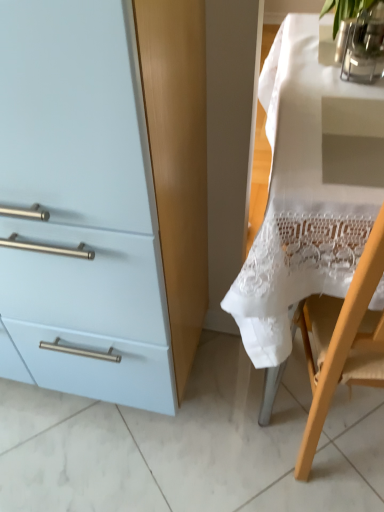
Question: From a real-world perspective, is white lace tablecloth at right physically above clear glass vase at upper right, the second glass vase positioned from the back?

Choices:
 (A) no
 (B) yes

Answer: (A)

Question: From the image's perspective, is white lace tablecloth at right beneath clear glass vase at upper right, which is counted as the 1th glass vase, starting from the front?

Choices:
 (A) no
 (B) yes

Answer: (B)

Question: From a real-world perspective, is white lace tablecloth at right below clear glass vase at upper right, which is counted as the 1th glass vase, starting from the front?

Choices:
 (A) no
 (B) yes

Answer: (B)

Question: Considering the relative sizes of white lace tablecloth at right and clear glass vase at upper right, the second glass vase positioned from the back, in the image provided, is white lace tablecloth at right shorter than clear glass vase at upper right, the second glass vase positioned from the back,?

Choices:
 (A) no
 (B) yes

Answer: (A)

Question: Does white lace tablecloth at right lie behind clear glass vase at upper right, which is counted as the 1th glass vase, starting from the front?

Choices:
 (A) yes
 (B) no

Answer: (B)

Question: Considering the positions of point (372, 79) and point (336, 47), is point (372, 79) closer or farther from the camera than point (336, 47)?

Choices:
 (A) farther
 (B) closer

Answer: (B)

Question: Considering the positions of clear glass vase at upper right, the second glass vase positioned from the back, and clear glass vase at upper right, marked as the first glass vase in a back-to-front arrangement, in the image, is clear glass vase at upper right, the second glass vase positioned from the back, taller or shorter than clear glass vase at upper right, marked as the first glass vase in a back-to-front arrangement,?

Choices:
 (A) short
 (B) tall

Answer: (A)

Question: From the image's perspective, is clear glass vase at upper right, which is counted as the 1th glass vase, starting from the front, located above or below clear glass vase at upper right, marked as the first glass vase in a back-to-front arrangement?

Choices:
 (A) above
 (B) below

Answer: (B)

Question: Looking at their shapes, would you say clear glass vase at upper right, the second glass vase positioned from the back, is wider or thinner than clear glass vase at upper right, the 2th glass vase from the front?

Choices:
 (A) thin
 (B) wide

Answer: (B)

Question: Is point (344, 19) closer or farther from the camera than point (332, 267)?

Choices:
 (A) farther
 (B) closer

Answer: (A)

Question: Considering the positions of clear glass vase at upper right, the 2th glass vase from the front, and white lace tablecloth at right in the image, is clear glass vase at upper right, the 2th glass vase from the front, wider or thinner than white lace tablecloth at right?

Choices:
 (A) wide
 (B) thin

Answer: (B)

Question: Considering the positions of clear glass vase at upper right, the 2th glass vase from the front, and white lace tablecloth at right in the image, is clear glass vase at upper right, the 2th glass vase from the front, taller or shorter than white lace tablecloth at right?

Choices:
 (A) tall
 (B) short

Answer: (B)

Question: Relative to white lace tablecloth at right, is clear glass vase at upper right, marked as the first glass vase in a back-to-front arrangement, in front or behind?

Choices:
 (A) front
 (B) behind

Answer: (B)

Question: In terms of width, does clear glass vase at upper right, the second glass vase positioned from the back, look wider or thinner when compared to light blue matte cabinet at left?

Choices:
 (A) wide
 (B) thin

Answer: (B)

Question: Considering the positions of clear glass vase at upper right, the second glass vase positioned from the back, and light blue matte cabinet at left in the image, is clear glass vase at upper right, the second glass vase positioned from the back, bigger or smaller than light blue matte cabinet at left?

Choices:
 (A) small
 (B) big

Answer: (A)